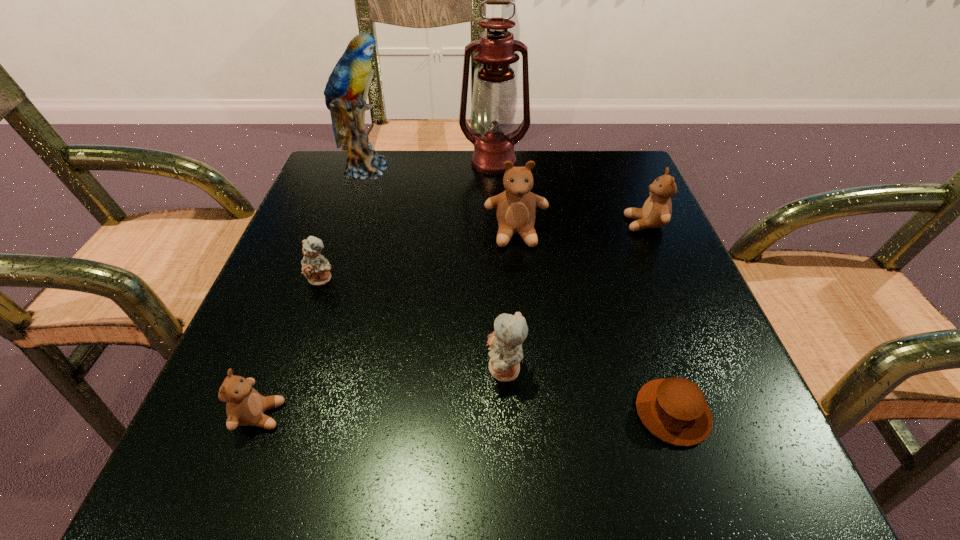
Identify the location of vacant region that satisfies the following two spatial constraints: 1. on the front-facing side of the tallest teddy bear; 2. on the front-facing side of the right blue teddy bear. This screenshot has width=960, height=540. (528, 370).

The image size is (960, 540). In order to click on blank area in the image that satisfies the following two spatial constraints: 1. on the front-facing side of the second smallest brown teddy bear; 2. on the front-facing side of the fourth nearest object in this screenshot , I will do `click(668, 279)`.